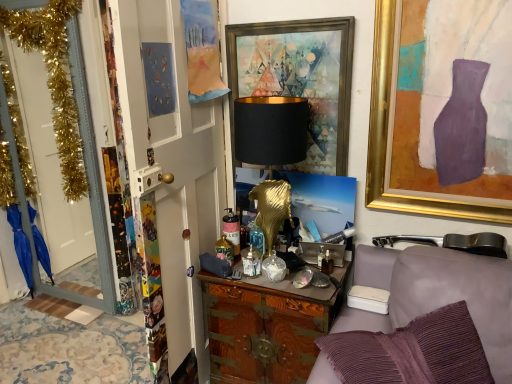
Question: Is there a large distance between white painted wood door at left, the 2th door positioned from the left, and white glossy door at left, which is the 2th door from front to back?

Choices:
 (A) yes
 (B) no

Answer: (A)

Question: Can you confirm if white painted wood door at left, arranged as the second door when viewed from the back, is taller than white glossy door at left, marked as the 2th door in a right-to-left arrangement?

Choices:
 (A) yes
 (B) no

Answer: (B)

Question: Is white painted wood door at left, arranged as the second door when viewed from the back, not within white glossy door at left, marked as the 2th door in a right-to-left arrangement?

Choices:
 (A) yes
 (B) no

Answer: (A)

Question: From a real-world perspective, is white painted wood door at left, which ranks as the 1th door in front-to-back order, on top of white glossy door at left, which is the 1th door in back-to-front order?

Choices:
 (A) yes
 (B) no

Answer: (B)

Question: Considering the relative sizes of white painted wood door at left, which is the first door in right-to-left order, and white glossy door at left, marked as the 2th door in a right-to-left arrangement, in the image provided, is white painted wood door at left, which is the first door in right-to-left order, wider than white glossy door at left, marked as the 2th door in a right-to-left arrangement,?

Choices:
 (A) no
 (B) yes

Answer: (B)

Question: From the image's perspective, is white painted wood door at left, the 2th door positioned from the left, on top of white glossy door at left, which is the 1th door in back-to-front order?

Choices:
 (A) no
 (B) yes

Answer: (A)

Question: Is gold-framed painting at upper right, which is the 1th picture frame from right to left, to the left of metallic gold picture frame at upper center, which appears as the 1th picture frame when viewed from the left, from the viewer's perspective?

Choices:
 (A) no
 (B) yes

Answer: (A)

Question: Are gold-framed painting at upper right, which is the 1th picture frame from right to left, and metallic gold picture frame at upper center, arranged as the second picture frame when viewed from the right, beside each other?

Choices:
 (A) yes
 (B) no

Answer: (B)

Question: From a real-world perspective, is gold-framed painting at upper right, which ranks as the second picture frame in left-to-right order, beneath metallic gold picture frame at upper center, which appears as the 1th picture frame when viewed from the left?

Choices:
 (A) no
 (B) yes

Answer: (A)

Question: Considering the relative sizes of gold-framed painting at upper right, which is the 1th picture frame from right to left, and metallic gold picture frame at upper center, which appears as the 1th picture frame when viewed from the left, in the image provided, is gold-framed painting at upper right, which is the 1th picture frame from right to left, bigger than metallic gold picture frame at upper center, which appears as the 1th picture frame when viewed from the left,?

Choices:
 (A) no
 (B) yes

Answer: (B)

Question: Is gold-framed painting at upper right, which is the 1th picture frame from right to left, outside metallic gold picture frame at upper center, arranged as the second picture frame when viewed from the right?

Choices:
 (A) yes
 (B) no

Answer: (A)

Question: Does gold-framed painting at upper right, which ranks as the second picture frame in left-to-right order, have a greater width compared to metallic gold picture frame at upper center, which appears as the 1th picture frame when viewed from the left?

Choices:
 (A) no
 (B) yes

Answer: (B)

Question: Are white glossy door at left, marked as the 2th door in a right-to-left arrangement, and black matte/golden base at center far apart?

Choices:
 (A) yes
 (B) no

Answer: (A)